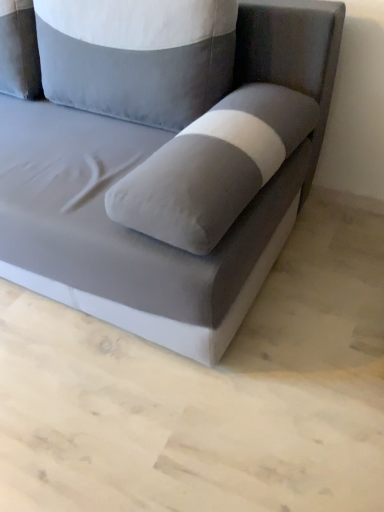
Based on the photo, measure the distance between suede gray couch at center and camera.

The distance of suede gray couch at center from camera is 36.09 inches.

This screenshot has height=512, width=384. Identify the location of suede gray couch at center. (143, 168).

What do you see at coordinates (143, 168) in the screenshot? Image resolution: width=384 pixels, height=512 pixels. I see `suede gray couch at center` at bounding box center [143, 168].

I want to click on suede gray couch at center, so click(x=143, y=168).